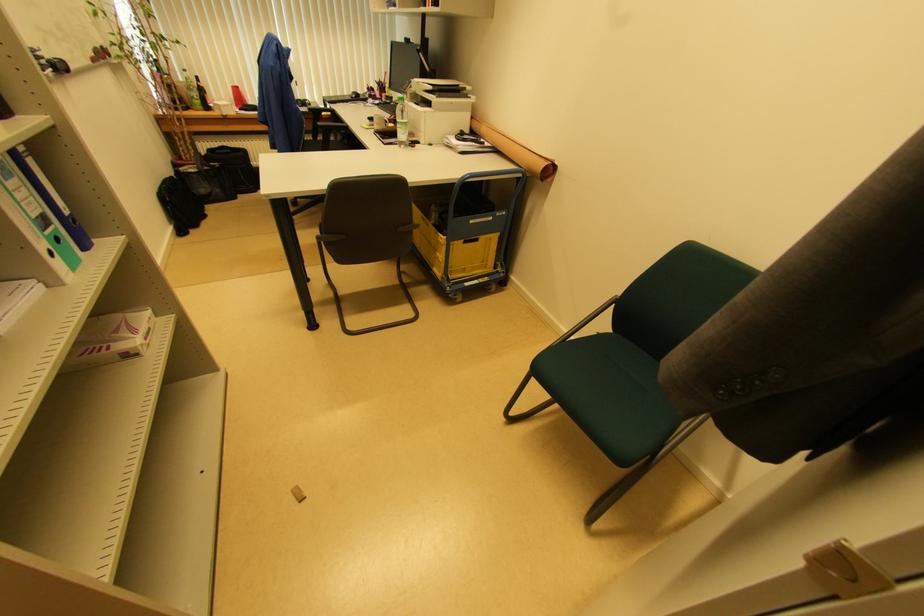
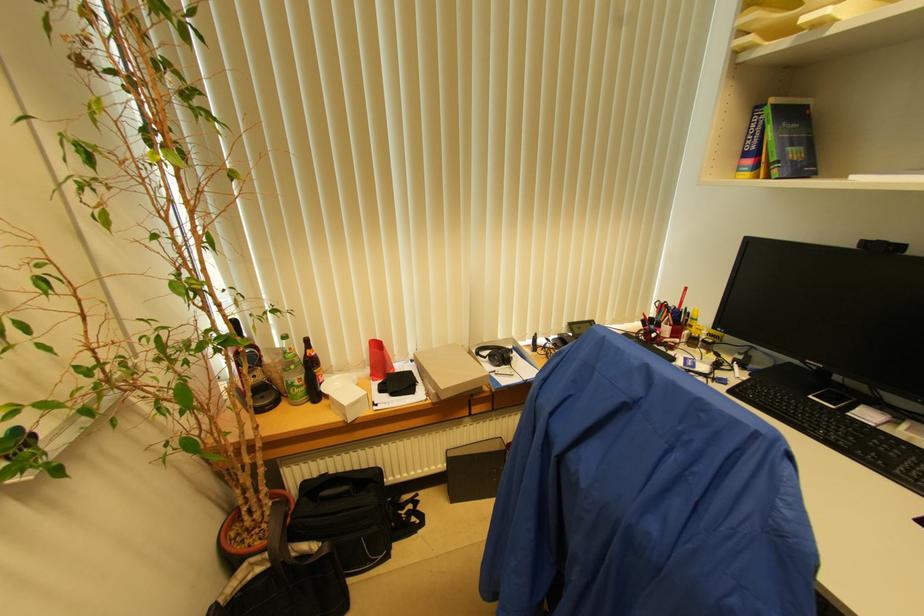
Find the pixel in the second image that matches point 200,98 in the first image.

(304, 379)